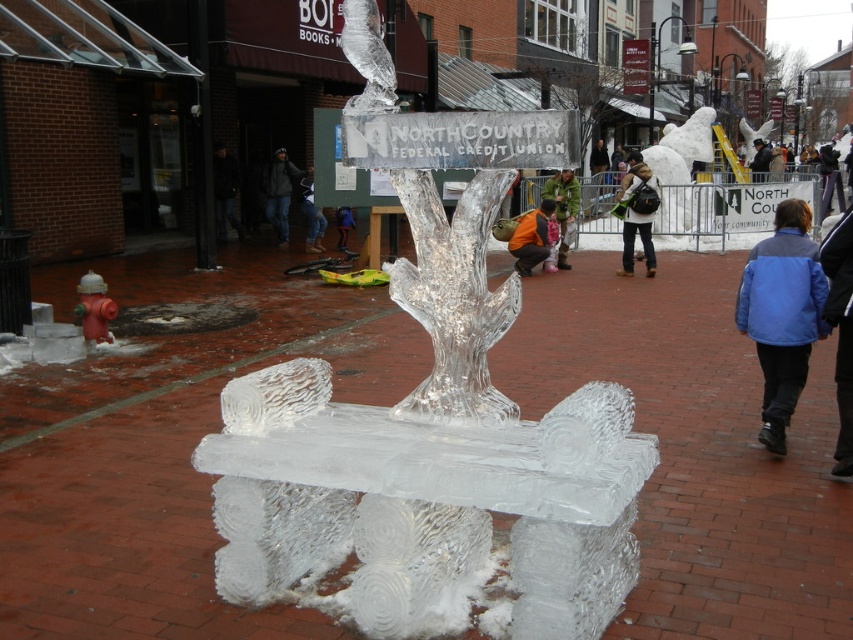
Question: Which object is positioned closest to the dark gray hoodie at center?

Choices:
 (A) clear ice bench at center
 (B) green fabric jacket at center
 (C) blue fabric jacket at lower right
 (D) dark blue jacket at center

Answer: (B)

Question: Which point is closer to the camera taking this photo?

Choices:
 (A) (288, 157)
 (B) (337, 220)
 (C) (303, 209)
 (D) (526, 252)

Answer: (D)

Question: Is red matte fire hydrant at lower left to the left of blue denim jeans at center from the viewer's perspective?

Choices:
 (A) no
 (B) yes

Answer: (B)

Question: Can you confirm if blue denim jeans at center is wider than dark blue jacket at center?

Choices:
 (A) yes
 (B) no

Answer: (A)

Question: Does clear ice bench at center have a larger size compared to dark blue jacket at center?

Choices:
 (A) no
 (B) yes

Answer: (B)

Question: Which point is closer to the camera?

Choices:
 (A) pyautogui.click(x=526, y=225)
 (B) pyautogui.click(x=762, y=147)
 (C) pyautogui.click(x=654, y=202)

Answer: (C)